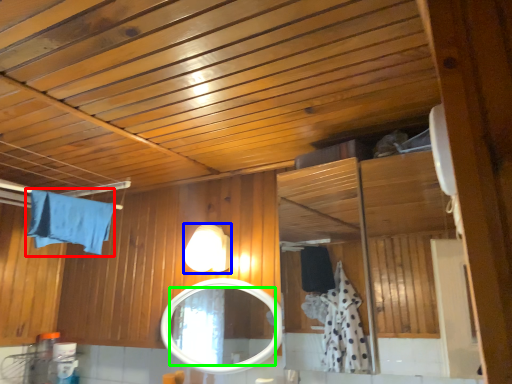
Question: Based on their relative distances, which object is farther from bath towel (highlighted by a red box)? Choose from light fixture (highlighted by a blue box) and mirror (highlighted by a green box).

Choices:
 (A) light fixture
 (B) mirror

Answer: (B)